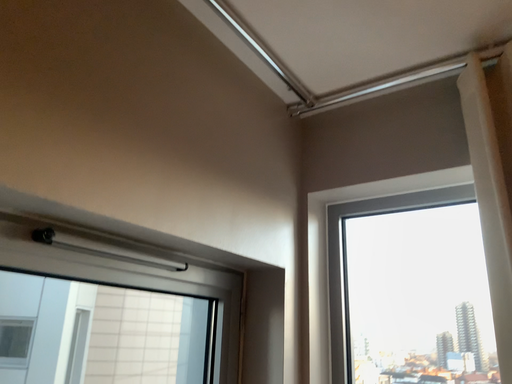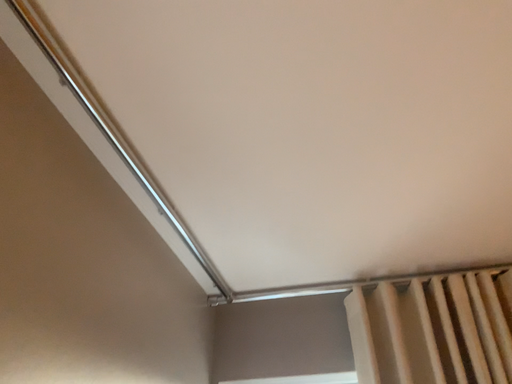
Question: Which way did the camera rotate in the video?

Choices:
 (A) rotated left
 (B) rotated right

Answer: (B)